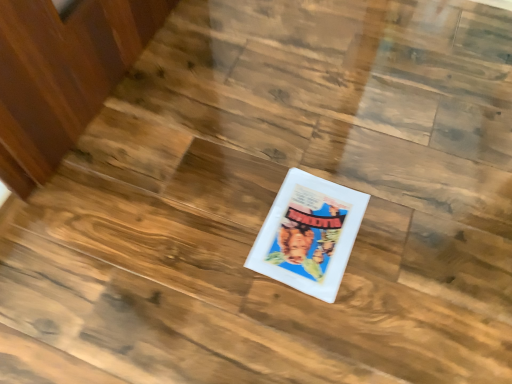
This screenshot has width=512, height=384. What are the coordinates of `vacant area that is in front of white glossy book at center` in the screenshot? It's located at (338, 311).